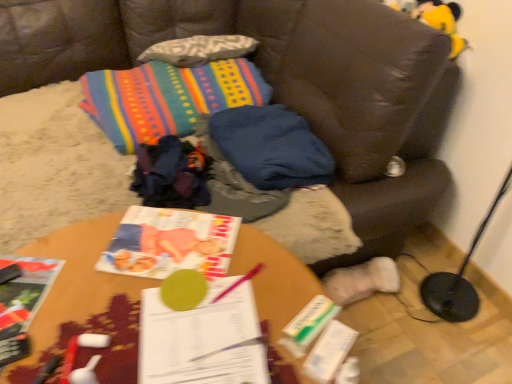
At what (x,y) coordinates should I click in order to perform the action: click on vacant space to the right of hardcover book at lower left, the third book from the right. Please return your answer as a coordinate pair (x, y). This screenshot has width=512, height=384. Looking at the image, I should click on (85, 312).